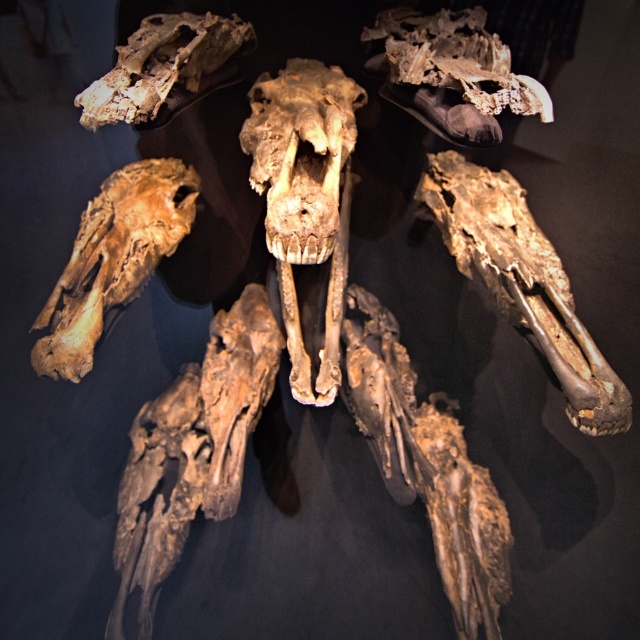
Is brown/weathered bone skull at center wider than brown fossilized skull at lower right?

In fact, brown/weathered bone skull at center might be narrower than brown fossilized skull at lower right.

Between point (324, 339) and point (566, 376), which one is positioned behind?

Point (324, 339)

What are the coordinates of `brown/weathered bone skull at center` in the screenshot? It's located at (305, 196).

Between brown/weathered bone skull at center and brown rough bone at center, which one has more height?

brown/weathered bone skull at center

Is brown/weathered bone skull at center thinner than brown rough bone at center?

Correct, brown/weathered bone skull at center's width is less than brown rough bone at center's.

Does point (316, 248) come closer to viewer compared to point (179, 182)?

Yes, it is in front of point (179, 182).

Locate an element on the screen. This screenshot has width=640, height=640. brown/weathered bone skull at center is located at coordinates 305,196.

Between brown/weathered bone skull at center and brown fossilized skull at upper left, which one is positioned lower?

brown/weathered bone skull at center is lower down.

Can you confirm if brown/weathered bone skull at center is shorter than brown fossilized skull at upper left?

No, brown/weathered bone skull at center is not shorter than brown fossilized skull at upper left.

Who is more forward, (339, 122) or (180, 22)?

Point (339, 122) is more forward.

Locate an element on the screen. This screenshot has height=640, width=640. brown/weathered bone skull at center is located at coordinates [x=305, y=196].